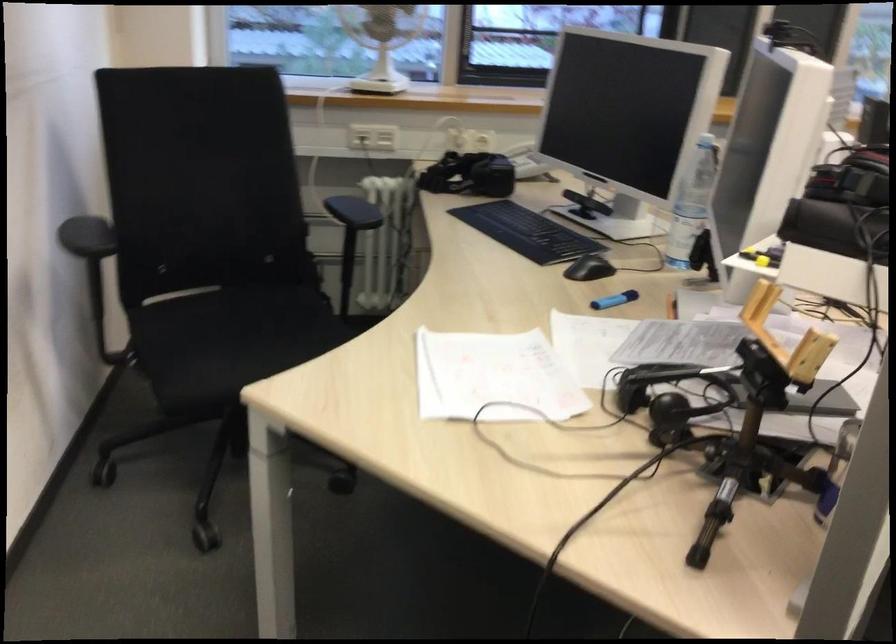
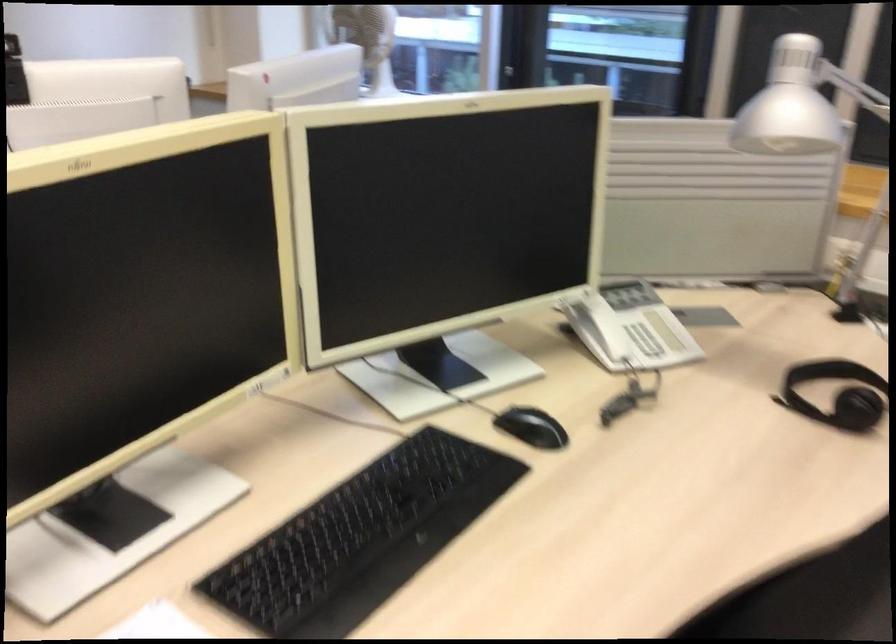
Question: I am providing you with two images of the same scene from different viewpoints. After the viewpoint changes to image2, which objects are now occluded?

Choices:
 (A) white power socket
 (B) red and black mug
 (C) telephone handset
 (D) black keyboard

Answer: (A)